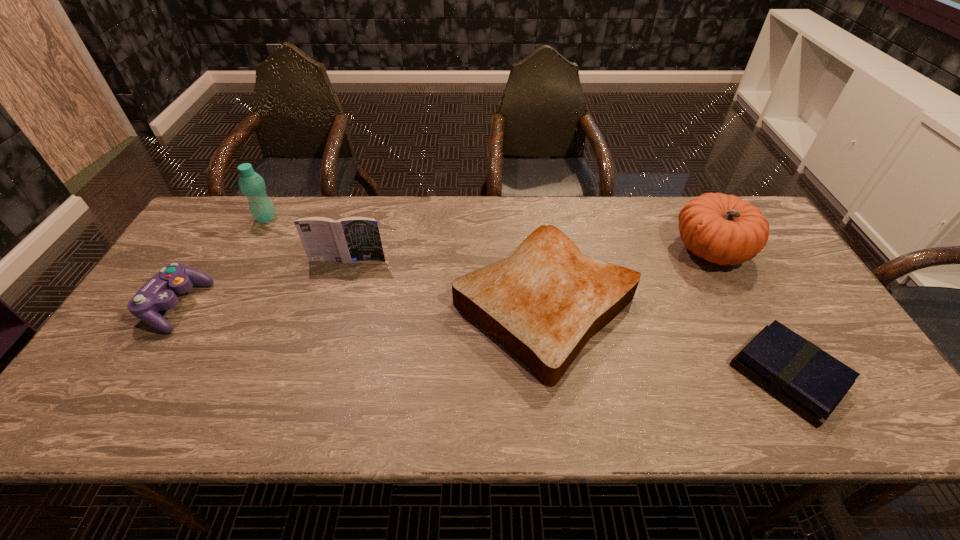
I want to click on the tallest object, so click(x=252, y=185).

Locate an element on the screen. The height and width of the screenshot is (540, 960). bottle is located at coordinates (252, 185).

Find the location of a particular element. pumpkin is located at coordinates (723, 229).

Where is `the taller book`? Image resolution: width=960 pixels, height=540 pixels. the taller book is located at coordinates (346, 240).

Identify the location of the farther book. This screenshot has width=960, height=540. (346, 240).

The width and height of the screenshot is (960, 540). I want to click on the leftmost object, so point(159,293).

This screenshot has height=540, width=960. Find the location of `bread`. bread is located at coordinates (543, 304).

Identify the location of the shorter book. (800, 374).

At what (x,y) coordinates should I click in order to perform the action: click on the right book. Please return your answer as a coordinate pair (x, y). The image size is (960, 540). Looking at the image, I should click on (800, 374).

The width and height of the screenshot is (960, 540). Identify the location of vacant space situated 0.090m on the front of the bottle. (252, 244).